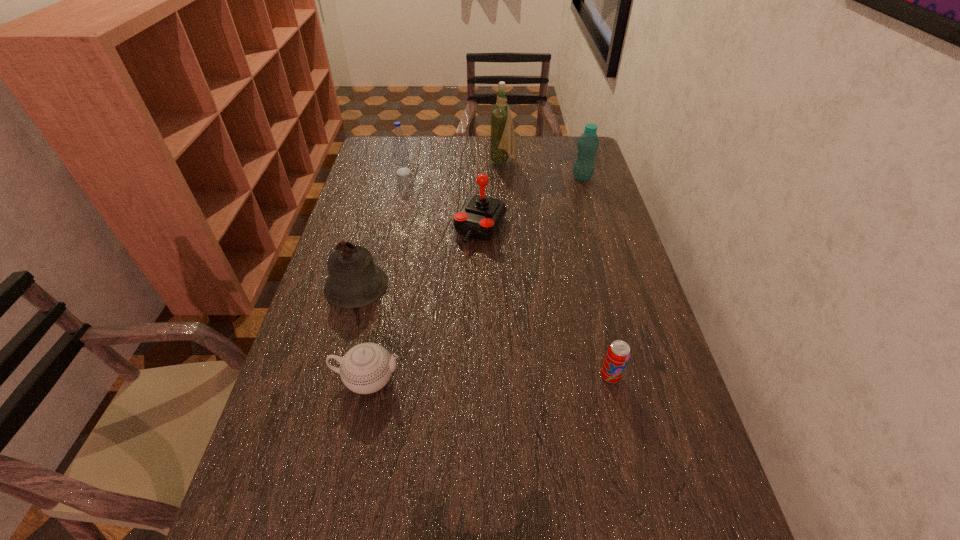
Where is `wine bottle`? wine bottle is located at coordinates (502, 138).

The height and width of the screenshot is (540, 960). Identify the location of the rightmost object. (588, 143).

You are a GUI agent. You are given a task and a screenshot of the screen. Output one action in this format:
    pyautogui.click(x=<x>, y=<y>)
    Task: Click on the left water bottle
    This screenshot has height=540, width=960.
    Given the screenshot: What is the action you would take?
    pyautogui.click(x=401, y=154)

Where is `the fourth nearest object`? the fourth nearest object is located at coordinates (480, 217).

Identify the location of bell. (355, 281).

Find the location of a particular element. The image size is (960, 540). chinaware is located at coordinates pyautogui.click(x=366, y=368).

Find the location of a particular element. This screenshot has width=960, height=540. the second object from right to left is located at coordinates (618, 353).

The height and width of the screenshot is (540, 960). What are the coordinates of `free space located 0.140m on the front-facing side of the wine bottle` in the screenshot? It's located at (453, 163).

Where is `vacant area situated on the front-facing side of the wine bottle`? The image size is (960, 540). vacant area situated on the front-facing side of the wine bottle is located at coordinates (467, 163).

This screenshot has width=960, height=540. Find the location of `vacant space located 0.140m on the front-facing side of the wine bottle`. vacant space located 0.140m on the front-facing side of the wine bottle is located at coordinates (453, 163).